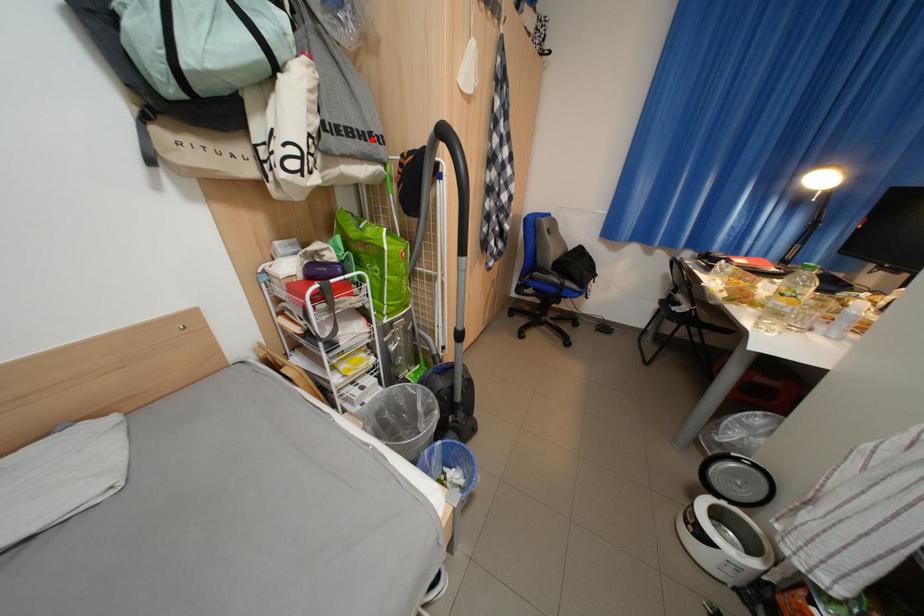
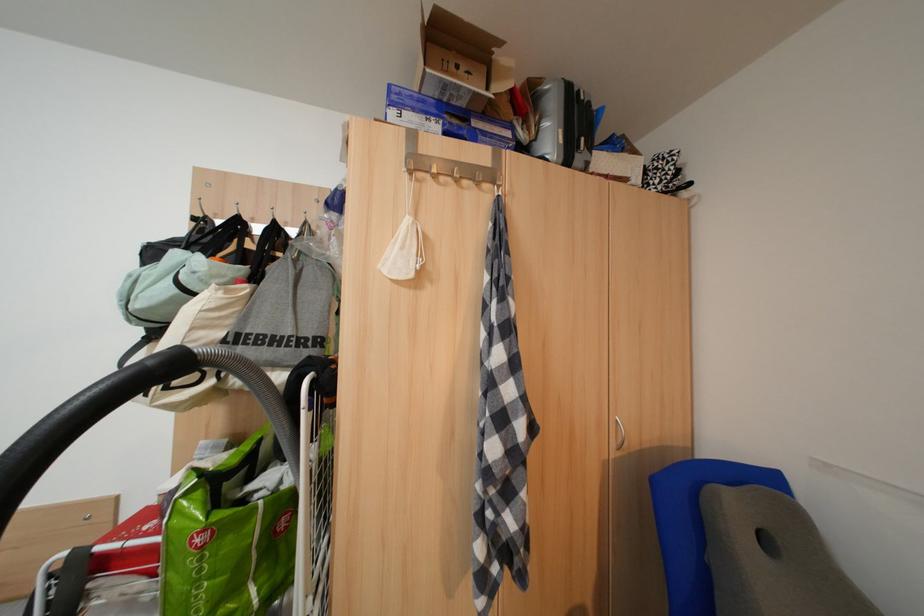
In the second image, find the point that corresponds to the highlighted location in the first image.

(282, 346)